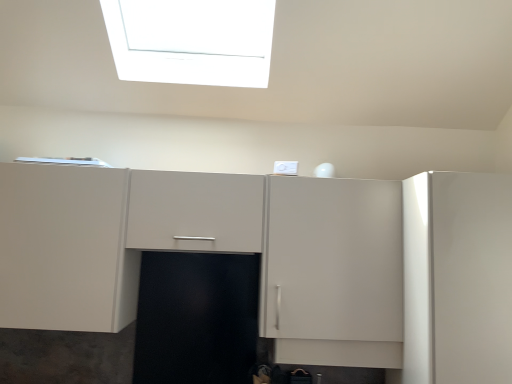
Question: Is glossy white cabinet at right, the second cabinetry from the left, looking in the opposite direction of matte white cabinet at center, the first cabinetry from the left?

Choices:
 (A) yes
 (B) no

Answer: (B)

Question: Is glossy white cabinet at right, the second cabinetry from the left, at the right side of matte white cabinet at center, which appears as the 2th cabinetry when viewed from the right?

Choices:
 (A) yes
 (B) no

Answer: (A)

Question: Is glossy white cabinet at right, the 1th cabinetry positioned from the right, bigger than matte white cabinet at center, the first cabinetry from the left?

Choices:
 (A) yes
 (B) no

Answer: (B)

Question: From the image's perspective, does glossy white cabinet at right, the second cabinetry from the left, appear lower than matte white cabinet at center, the first cabinetry from the left?

Choices:
 (A) no
 (B) yes

Answer: (B)

Question: Considering the relative sizes of glossy white cabinet at right, the 1th cabinetry positioned from the right, and matte white cabinet at center, which appears as the 2th cabinetry when viewed from the right, in the image provided, is glossy white cabinet at right, the 1th cabinetry positioned from the right, taller than matte white cabinet at center, which appears as the 2th cabinetry when viewed from the right,?

Choices:
 (A) no
 (B) yes

Answer: (B)

Question: Is glossy white cabinet at right, the 1th cabinetry positioned from the right, not inside matte white cabinet at center, the first cabinetry from the left?

Choices:
 (A) no
 (B) yes

Answer: (B)

Question: Considering the relative sizes of matte white cabinet at center, the first cabinetry from the left, and glossy white cabinet at right, the 1th cabinetry positioned from the right, in the image provided, is matte white cabinet at center, the first cabinetry from the left, wider than glossy white cabinet at right, the 1th cabinetry positioned from the right,?

Choices:
 (A) no
 (B) yes

Answer: (A)

Question: Is matte white cabinet at center, the first cabinetry from the left, far from glossy white cabinet at right, the second cabinetry from the left?

Choices:
 (A) yes
 (B) no

Answer: (B)

Question: Can glossy white cabinet at right, the 1th cabinetry positioned from the right, be found inside matte white cabinet at center, the first cabinetry from the left?

Choices:
 (A) yes
 (B) no

Answer: (B)

Question: Is matte white cabinet at center, which appears as the 2th cabinetry when viewed from the right, positioned beyond the bounds of glossy white cabinet at right, the 1th cabinetry positioned from the right?

Choices:
 (A) no
 (B) yes

Answer: (B)

Question: Can you confirm if matte white cabinet at center, which appears as the 2th cabinetry when viewed from the right, is positioned to the right of glossy white cabinet at right, the second cabinetry from the left?

Choices:
 (A) no
 (B) yes

Answer: (A)

Question: Is matte white cabinet at center, which appears as the 2th cabinetry when viewed from the right, positioned behind glossy white cabinet at right, the second cabinetry from the left?

Choices:
 (A) yes
 (B) no

Answer: (A)

Question: Choose the correct answer: Is glossy white cabinet at right, the second cabinetry from the left, inside matte white cabinet at center, which appears as the 2th cabinetry when viewed from the right, or outside it?

Choices:
 (A) inside
 (B) outside

Answer: (B)